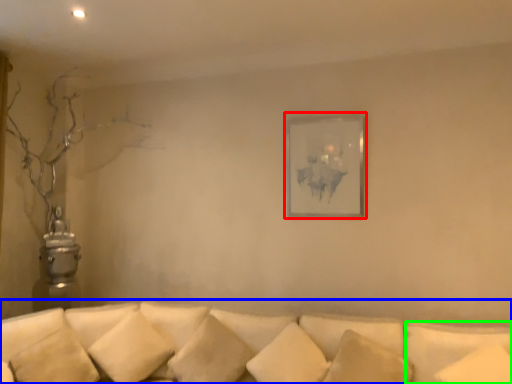
Question: Which object is the closest to the picture frame (highlighted by a red box)? Choose among these: studio couch (highlighted by a blue box) or pillow (highlighted by a green box).

Choices:
 (A) studio couch
 (B) pillow

Answer: (B)